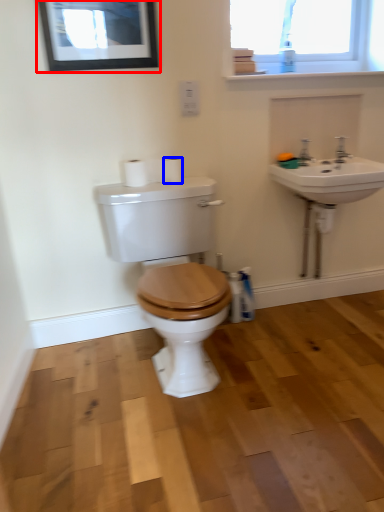
Question: Which object is further to the camera taking this photo, picture frame (highlighted by a red box) or toilet paper (highlighted by a blue box)?

Choices:
 (A) picture frame
 (B) toilet paper

Answer: (B)